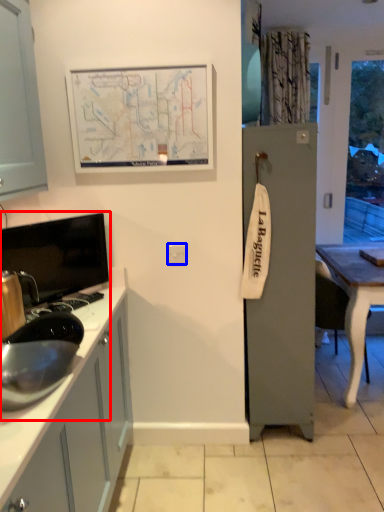
Question: Among these objects, which one is farthest to the camera, sink (highlighted by a red box) or electric outlet (highlighted by a blue box)?

Choices:
 (A) sink
 (B) electric outlet

Answer: (B)